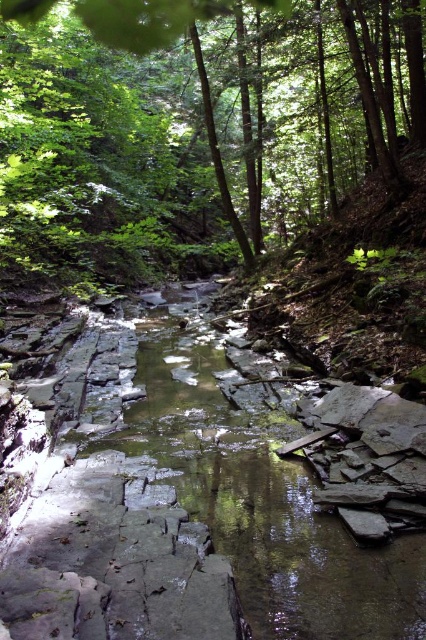
Question: Among these objects, which one is nearest to the camera?

Choices:
 (A) gray stone stream at center
 (B) green leafy tree at upper center

Answer: (A)

Question: Is green leafy tree at upper center behind gray stone stream at center?

Choices:
 (A) yes
 (B) no

Answer: (A)

Question: Is green leafy tree at upper center to the left of gray stone stream at center from the viewer's perspective?

Choices:
 (A) no
 (B) yes

Answer: (A)

Question: Can you confirm if green leafy tree at upper center is thinner than gray stone stream at center?

Choices:
 (A) no
 (B) yes

Answer: (A)